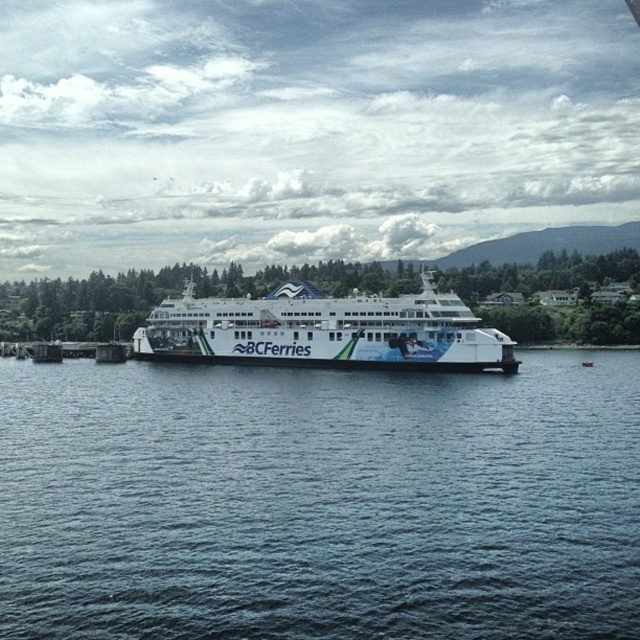
Question: Estimate the real-world distances between objects in this image. Which object is closer to the brown wooden dock at lower left?

Choices:
 (A) white glossy ferry at center
 (B) blue water at center

Answer: (A)

Question: Is blue water at center further to camera compared to white glossy ferry at center?

Choices:
 (A) yes
 (B) no

Answer: (B)

Question: Is the position of blue water at center more distant than that of brown wooden dock at lower left?

Choices:
 (A) yes
 (B) no

Answer: (B)

Question: Estimate the real-world distances between objects in this image. Which object is farther from the brown wooden dock at lower left?

Choices:
 (A) blue water at center
 (B) white glossy ferry at center

Answer: (A)

Question: Among these points, which one is nearest to the camera?

Choices:
 (A) (221, 310)
 (B) (104, 356)
 (C) (291, 522)

Answer: (C)

Question: Can you confirm if blue water at center is wider than brown wooden dock at lower left?

Choices:
 (A) yes
 (B) no

Answer: (A)